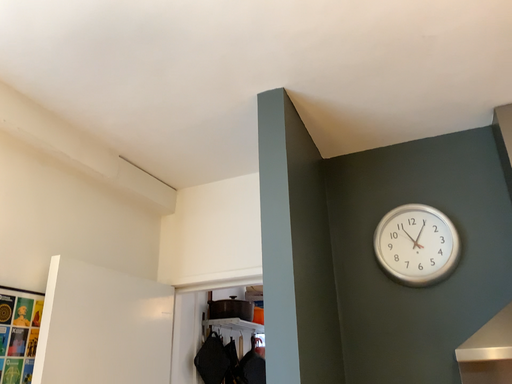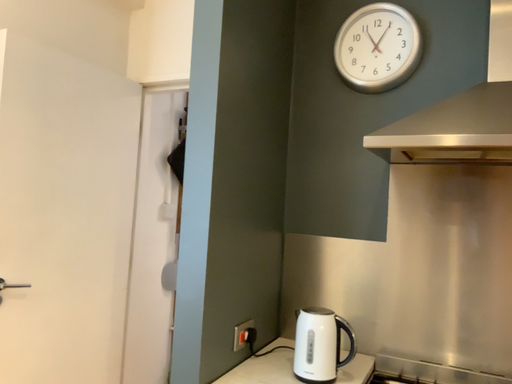
Question: How did the camera likely rotate when shooting the video?

Choices:
 (A) rotated upward
 (B) rotated downward

Answer: (B)